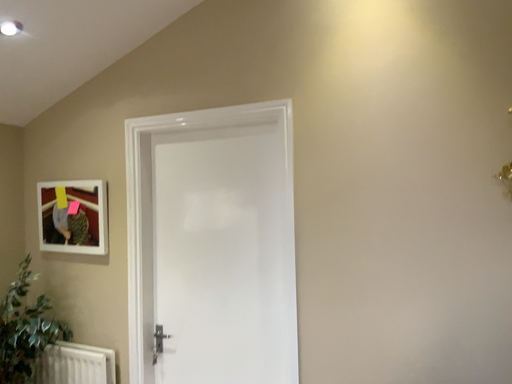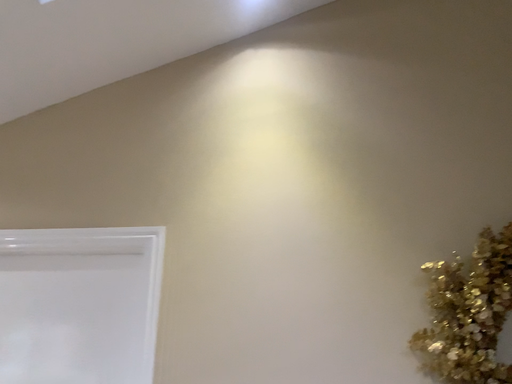
Question: How did the camera likely rotate when shooting the video?

Choices:
 (A) rotated right
 (B) rotated left

Answer: (A)